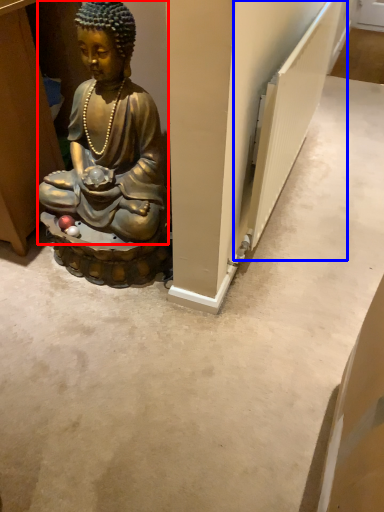
Question: Which point is further to the camera, person (highlighted by a red box) or radiator (highlighted by a blue box)?

Choices:
 (A) person
 (B) radiator

Answer: (B)